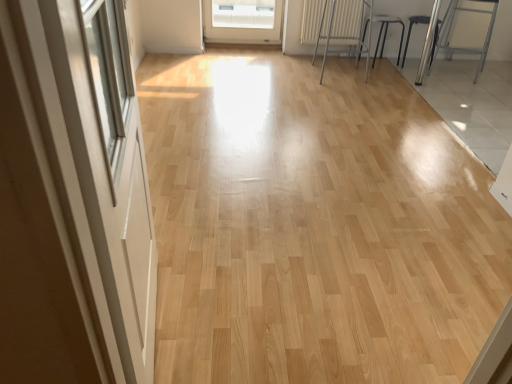
At what (x,y) coordinates should I click in order to perform the action: click on vacant space behind white glossy screen door at left. Please return your answer as a coordinate pair (x, y). The height and width of the screenshot is (384, 512). Looking at the image, I should click on (209, 250).